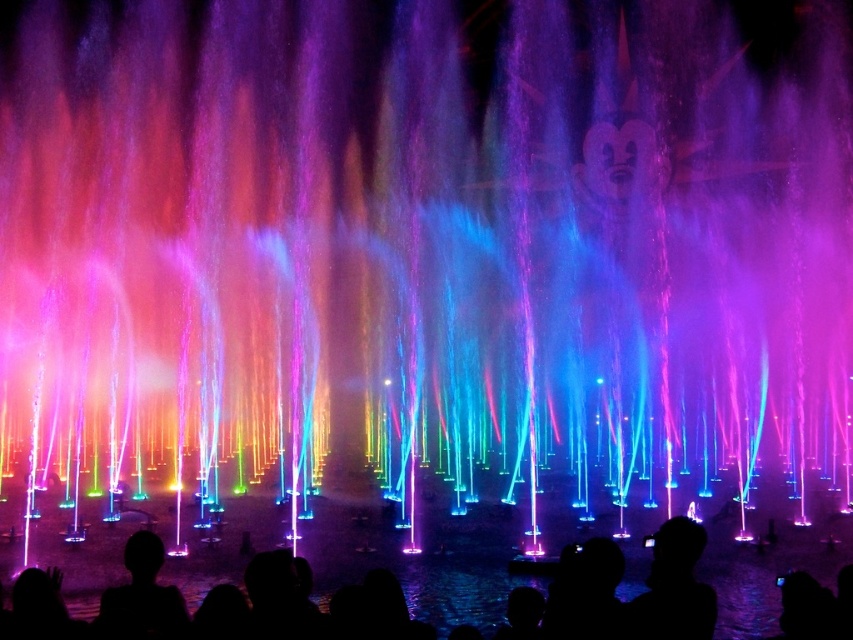
Question: Can you confirm if silhouette head at lower center is bigger than silhouette head at lower left?

Choices:
 (A) yes
 (B) no

Answer: (A)

Question: Is silhouette head at lower center closer to camera compared to silhouette head at center?

Choices:
 (A) yes
 (B) no

Answer: (B)

Question: Among these objects, which one is nearest to the camera?

Choices:
 (A) silhouette head at lower left
 (B) silhouette head at center
 (C) silhouette head at lower center

Answer: (A)

Question: Which point is farther to the camera?

Choices:
 (A) silhouette head at lower center
 (B) silhouette head at center

Answer: (A)

Question: Which object is positioned closest to the silhouette head at lower left?

Choices:
 (A) silhouette head at center
 (B) silhouette head at lower center

Answer: (B)

Question: Is silhouette head at center thinner than silhouette head at lower left?

Choices:
 (A) no
 (B) yes

Answer: (B)